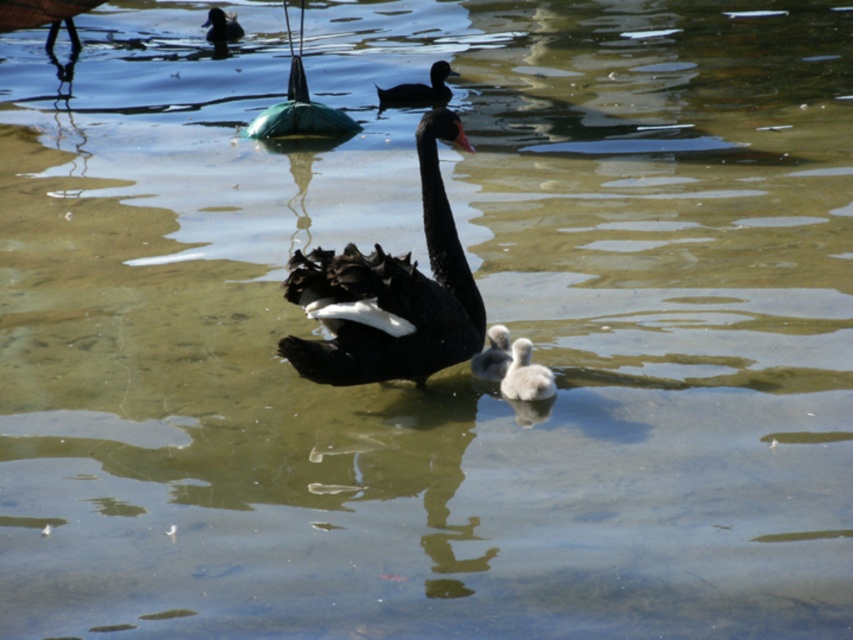
Is black glossy goose at center to the left of black glossy duck at upper left from the viewer's perspective?

Incorrect, black glossy goose at center is not on the left side of black glossy duck at upper left.

Is black glossy goose at center shorter than black glossy duck at upper left?

No, black glossy goose at center is not shorter than black glossy duck at upper left.

At what (x,y) coordinates should I click in order to perform the action: click on black glossy goose at center. Please return your answer as a coordinate pair (x, y). Image resolution: width=853 pixels, height=640 pixels. Looking at the image, I should click on (390, 294).

Locate an element on the screen. This screenshot has width=853, height=640. black glossy goose at center is located at coordinates click(390, 294).

Based on the photo, does black glossy goose at center lie in front of black matte duck at upper center?

Yes, it is.

Which is in front, point (463, 358) or point (419, 83)?

Point (463, 358) is more forward.

Find the location of a particular element. Image resolution: width=853 pixels, height=640 pixels. black glossy goose at center is located at coordinates pos(390,294).

Which is behind, point (465, 339) or point (271, 108)?

Positioned behind is point (271, 108).

Is black glossy goose at center to the left of green rubber buoy at upper center from the viewer's perspective?

Incorrect, black glossy goose at center is not on the left side of green rubber buoy at upper center.

Does point (454, 362) lie behind point (294, 84)?

No, it is not.

Identify the location of black glossy goose at center. (390, 294).